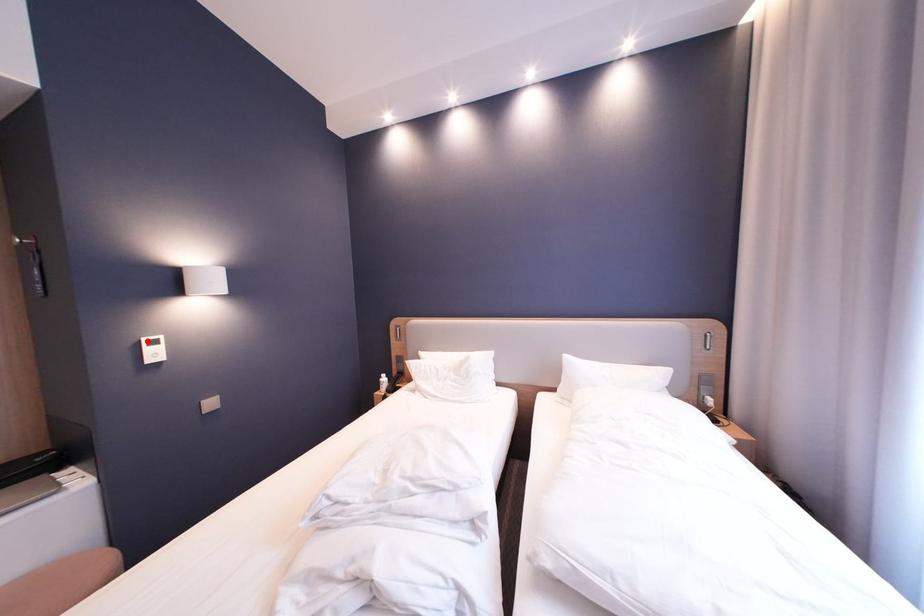
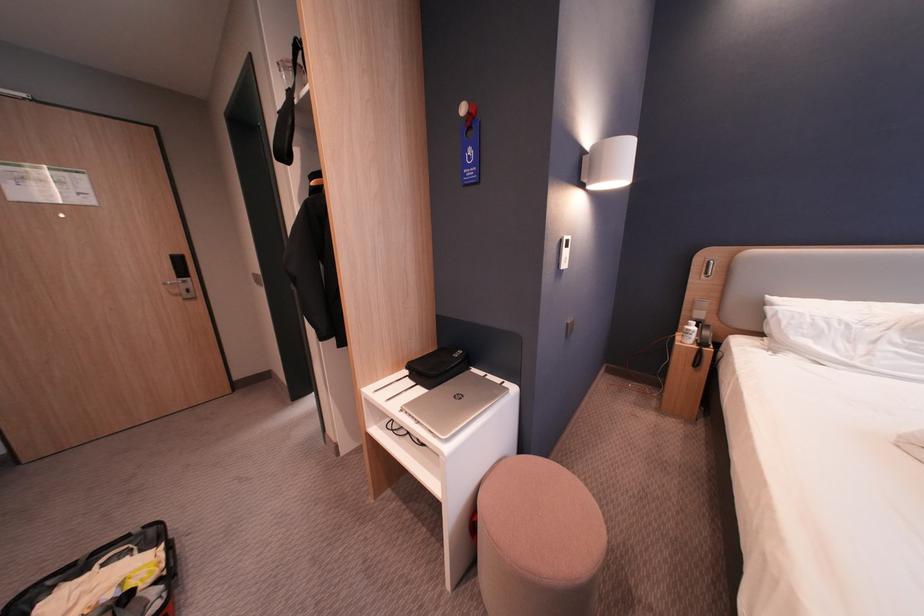
In the second image, find the point that corresponds to the highlighted location in the first image.

(569, 240)